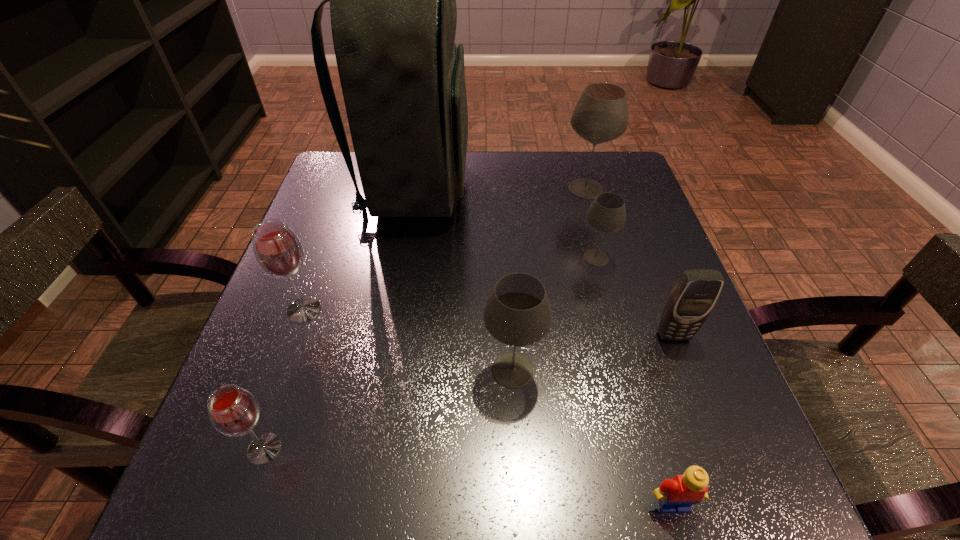
Identify the location of vacant area situated 0.320m on the right of the seventh farthest object. (495, 449).

The height and width of the screenshot is (540, 960). I want to click on blank space located 0.350m on the left of the sixth nearest object, so click(x=417, y=258).

Find the location of `backpack situated at the far edge`. backpack situated at the far edge is located at coordinates (393, 11).

The width and height of the screenshot is (960, 540). I want to click on wineglass at the far edge, so click(601, 115).

Identify the location of wineglass that is at the near edge. This screenshot has height=540, width=960. (233, 411).

At what (x,y) coordinates should I click in order to perform the action: click on Lego located in the near edge section of the desktop. Please return your answer as a coordinate pair (x, y). Looking at the image, I should click on (674, 495).

Locate an element on the screen. The width and height of the screenshot is (960, 540). backpack positioned at the left edge is located at coordinates (393, 11).

In order to click on cellular telephone located in the right edge section of the desktop in this screenshot , I will do `click(695, 293)`.

At what (x,y) coordinates should I click in order to perform the action: click on Lego positioned at the right edge. Please return your answer as a coordinate pair (x, y). Looking at the image, I should click on [674, 495].

This screenshot has width=960, height=540. In order to click on object positioned at the far left corner in this screenshot , I will do `click(393, 11)`.